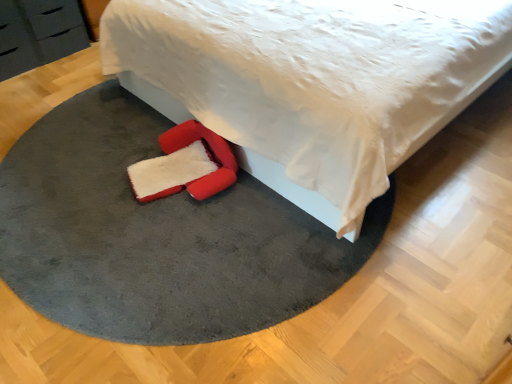
The image size is (512, 384). What are the coordinates of `vacant point above velvet gray rug at center (from a real-world perspective)` in the screenshot? It's located at (134, 207).